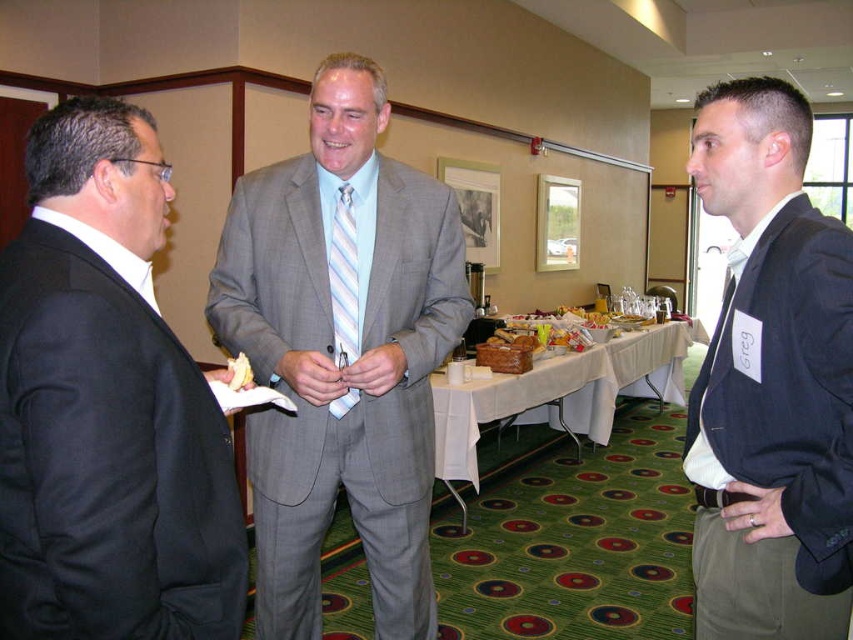
This screenshot has height=640, width=853. What do you see at coordinates (106, 406) in the screenshot? I see `black matte suit at left` at bounding box center [106, 406].

Is black matte suit at left closer to camera compared to gray textured suit at center?

That is True.

Does point (30, 300) come closer to viewer compared to point (352, 74)?

Yes, it is.

The width and height of the screenshot is (853, 640). In order to click on black matte suit at left in this screenshot , I will do `click(106, 406)`.

Is white cloth table at center smaller than yellow bread at center?

Incorrect, white cloth table at center is not smaller in size than yellow bread at center.

Is point (445, 477) closer to camera compared to point (241, 365)?

No, it is not.

In order to click on white cloth table at center in this screenshot , I will do `click(560, 392)`.

Can you confirm if dark blue suit at right is thinner than white cloth table at center?

Indeed, dark blue suit at right has a lesser width compared to white cloth table at center.

Does dark blue suit at right appear on the left side of white cloth table at center?

Yes, dark blue suit at right is to the left of white cloth table at center.

Who is more forward, [740,632] or [508,404]?

Point [740,632]

The height and width of the screenshot is (640, 853). In order to click on dark blue suit at right in this screenshot , I will do `click(770, 381)`.